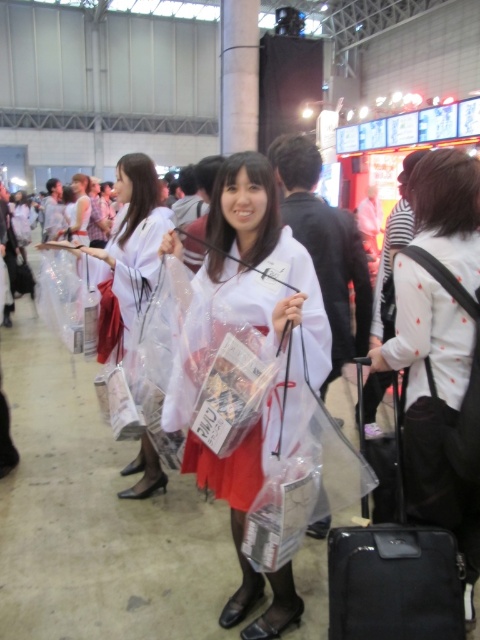
Does white matte kimono at center appear under black synthetic suitcase at lower right?

No, white matte kimono at center is not below black synthetic suitcase at lower right.

Find the location of `white matte kimono at center`. white matte kimono at center is located at coordinates (262, 259).

Is point (244, 481) more distant than point (415, 605)?

Yes, it is.

Where is `white matte kimono at center`? white matte kimono at center is located at coordinates (262, 259).

Does black synthetic suitcase at lower right have a greater width compared to white glossy kimono at center?

No, black synthetic suitcase at lower right is not wider than white glossy kimono at center.

From the picture: Can you confirm if black synthetic suitcase at lower right is positioned below white glossy kimono at center?

Yes, black synthetic suitcase at lower right is below white glossy kimono at center.

Who is more distant from viewer, (351,592) or (132,292)?

The point (132,292) is more distant.

Find the location of a particular element. black synthetic suitcase at lower right is located at coordinates (393, 557).

Does white dotted shirt at center have a greater height compared to white matte kimono at center?

Correct, white dotted shirt at center is much taller as white matte kimono at center.

Does white dotted shirt at center have a lesser width compared to white matte kimono at center?

Correct, white dotted shirt at center's width is less than white matte kimono at center's.

Is point (420, 248) positioned in front of point (226, 214)?

No, (420, 248) is behind (226, 214).

This screenshot has height=640, width=480. Identify the location of white dotted shirt at center. (432, 406).